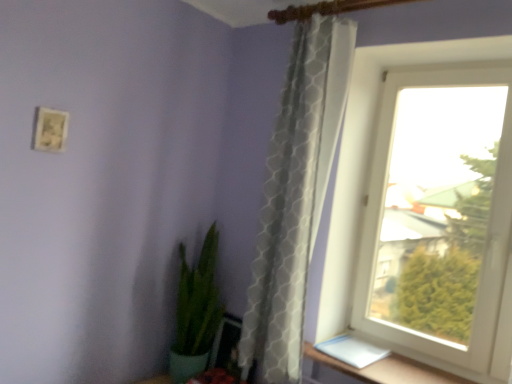
Question: Considering the relative positions of white plastic window at upper right and green glossy plant at lower left in the image provided, is white plastic window at upper right to the right of green glossy plant at lower left from the viewer's perspective?

Choices:
 (A) yes
 (B) no

Answer: (A)

Question: Would you say white plastic window at upper right contains green glossy plant at lower left?

Choices:
 (A) yes
 (B) no

Answer: (B)

Question: Considering the relative positions of white plastic window at upper right and green glossy plant at lower left in the image provided, is white plastic window at upper right to the left of green glossy plant at lower left from the viewer's perspective?

Choices:
 (A) no
 (B) yes

Answer: (A)

Question: Is white plastic window at upper right positioned behind green glossy plant at lower left?

Choices:
 (A) no
 (B) yes

Answer: (A)

Question: Is white plastic window at upper right aimed at green glossy plant at lower left?

Choices:
 (A) no
 (B) yes

Answer: (A)

Question: Considering the relative positions of white plastic window at upper right and green glossy plant at lower left in the image provided, is white plastic window at upper right to the left or to the right of green glossy plant at lower left?

Choices:
 (A) right
 (B) left

Answer: (A)

Question: From their relative heights in the image, would you say white plastic window at upper right is taller or shorter than green glossy plant at lower left?

Choices:
 (A) tall
 (B) short

Answer: (A)

Question: Choose the correct answer: Is white plastic window at upper right inside green glossy plant at lower left or outside it?

Choices:
 (A) inside
 (B) outside

Answer: (B)

Question: Considering the positions of point (509, 299) and point (218, 304), is point (509, 299) closer or farther from the camera than point (218, 304)?

Choices:
 (A) farther
 (B) closer

Answer: (B)

Question: From a real-world perspective, is matte white picture frame at upper left physically located above or below white textured curtain at right?

Choices:
 (A) below
 (B) above

Answer: (B)

Question: Is matte white picture frame at upper left inside or outside of white textured curtain at right?

Choices:
 (A) inside
 (B) outside

Answer: (B)

Question: Is point (58, 135) closer or farther from the camera than point (272, 314)?

Choices:
 (A) closer
 (B) farther

Answer: (A)

Question: Considering the positions of matte white picture frame at upper left and white textured curtain at right in the image, is matte white picture frame at upper left wider or thinner than white textured curtain at right?

Choices:
 (A) wide
 (B) thin

Answer: (B)

Question: Visually, is green glossy plant at lower left positioned to the left or to the right of matte white picture frame at upper left?

Choices:
 (A) right
 (B) left

Answer: (A)

Question: In terms of width, does green glossy plant at lower left look wider or thinner when compared to matte white picture frame at upper left?

Choices:
 (A) wide
 (B) thin

Answer: (A)